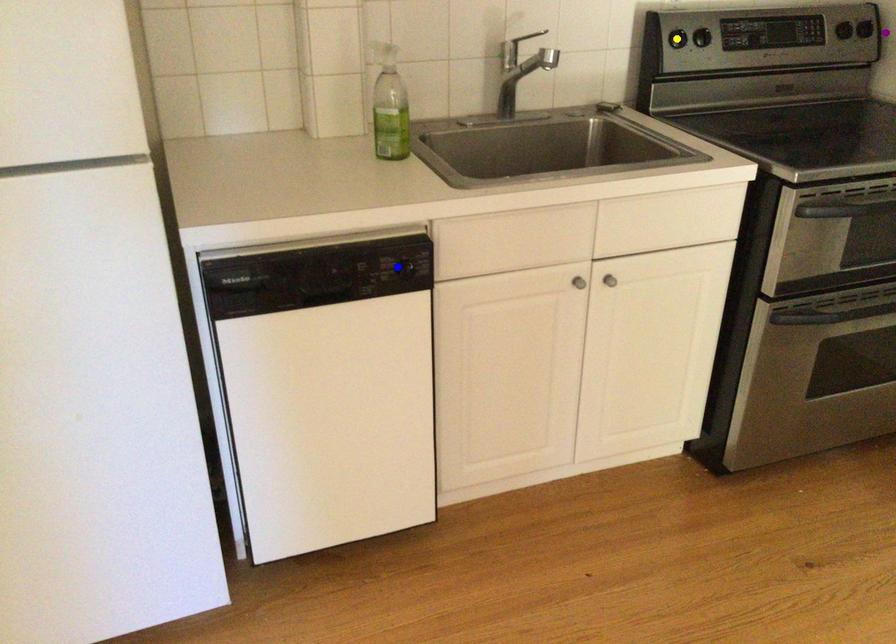
Order these from nearest to farthest:
blue point, yellow point, purple point

purple point, yellow point, blue point